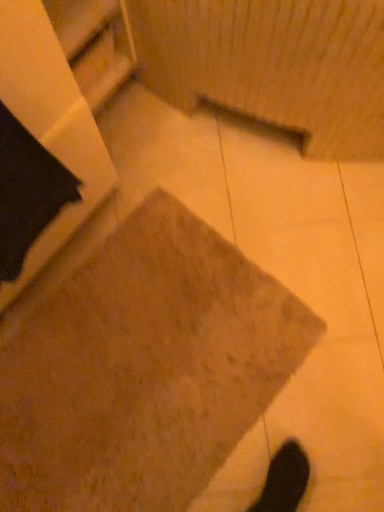
You are a GUI agent. You are given a task and a screenshot of the screen. Output one action in this format:
    pyautogui.click(x=<x>, y=<y>)
    Task: Click on the empty space that is ontop of brown textured concrete at center (from a real-world perspective)
    The image size is (384, 512).
    Given the screenshot: What is the action you would take?
    pyautogui.click(x=130, y=369)